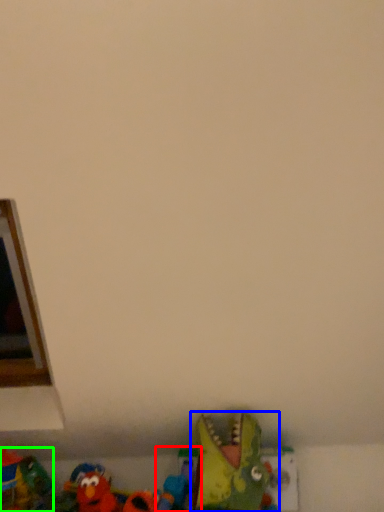
Question: Estimate the real-world distances between objects in this image. Which object is farther from toy (highlighted by a red box), toy (highlighted by a blue box) or toy (highlighted by a green box)?

Choices:
 (A) toy
 (B) toy

Answer: (B)